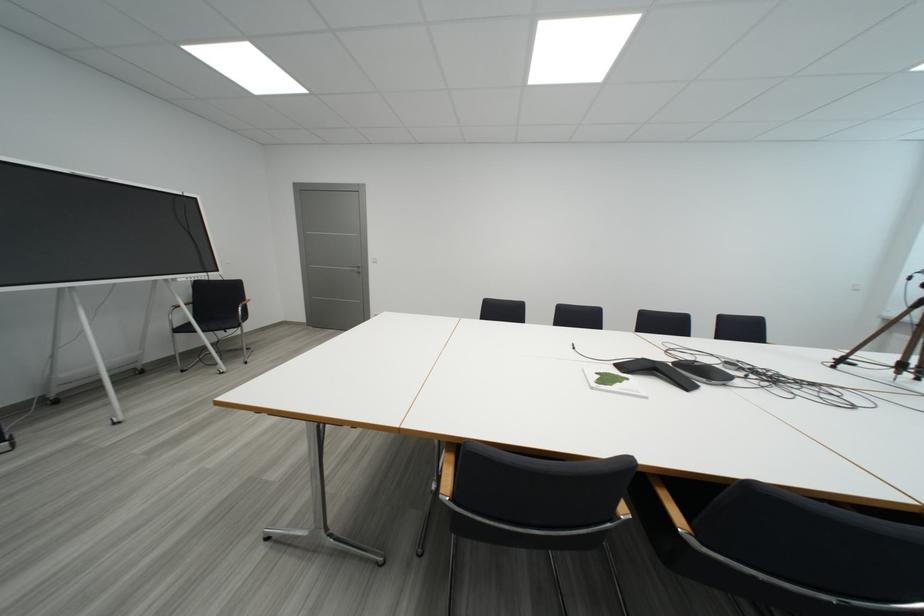
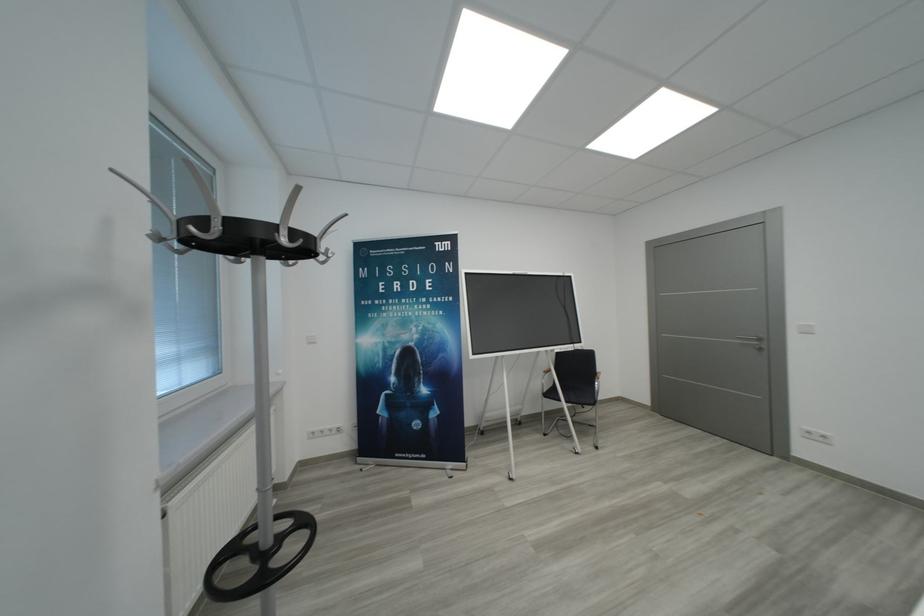
Question: The camera is either moving clockwise (left) or counter-clockwise (right) around the object. The first image is from the beginning of the video and the second image is from the end. Is the camera moving left or right when shooting the video?

Choices:
 (A) Left
 (B) Right

Answer: (B)